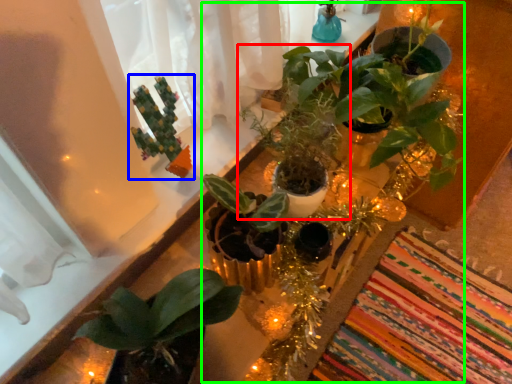
Question: Which object is the farthest from houseplant (highlighted by a red box)? Choose among these: houseplant (highlighted by a blue box) or floral arrangement (highlighted by a green box).

Choices:
 (A) houseplant
 (B) floral arrangement

Answer: (A)